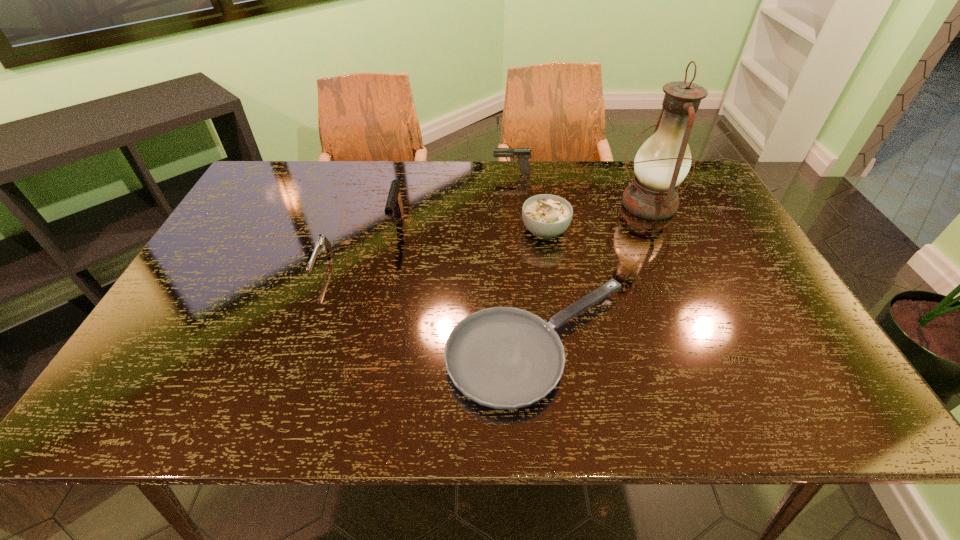
This screenshot has height=540, width=960. What are the coordinates of `frying pan` in the screenshot? It's located at (502, 357).

Where is `vacant space located on the left of the tallest object`? This screenshot has height=540, width=960. vacant space located on the left of the tallest object is located at coordinates (569, 204).

In order to click on vacant region located at the barrel of the fifth object from right to left in this screenshot , I will do `click(390, 261)`.

The width and height of the screenshot is (960, 540). Identify the location of free space located 0.170m aim along the barrel of the rightmost pistol. (442, 173).

This screenshot has height=540, width=960. Find the location of `blank space located 0.080m aim along the barrel of the rightmost pistol`. blank space located 0.080m aim along the barrel of the rightmost pistol is located at coordinates (468, 173).

You are a GUI agent. You are given a task and a screenshot of the screen. Output one action in this format:
    pyautogui.click(x=<x>, y=<y>)
    Task: Click on the vacant space positioned 0.260m aim along the barrel of the rightmost pistol
    
    Given the screenshot: What is the action you would take?
    pyautogui.click(x=415, y=173)

Find the location of a particular element. The width and height of the screenshot is (960, 540). free spot located 0.150m on the right of the soup bowl is located at coordinates (622, 231).

Where is `free location located 0.050m on the front-facing side of the shortest pistol`? Image resolution: width=960 pixels, height=540 pixels. free location located 0.050m on the front-facing side of the shortest pistol is located at coordinates (308, 302).

Where is `free spot located on the right of the frying pan`? The image size is (960, 540). free spot located on the right of the frying pan is located at coordinates (736, 345).

Locate an element on the screen. This screenshot has height=540, width=960. oil lamp that is at the far edge is located at coordinates (663, 161).